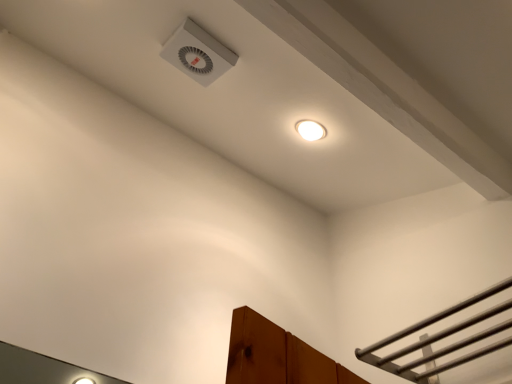
The width and height of the screenshot is (512, 384). Describe the element at coordinates (198, 53) in the screenshot. I see `white plastic vent at upper center` at that location.

Find the location of a particular element. white plastic vent at upper center is located at coordinates (198, 53).

You are a GUI agent. You are given a task and a screenshot of the screen. Output one action in this format:
    pyautogui.click(x=<x>, y=<y>)
    Task: Click on the white plastic vent at upper center
    This screenshot has width=512, height=384.
    Given the screenshot: What is the action you would take?
    pyautogui.click(x=198, y=53)